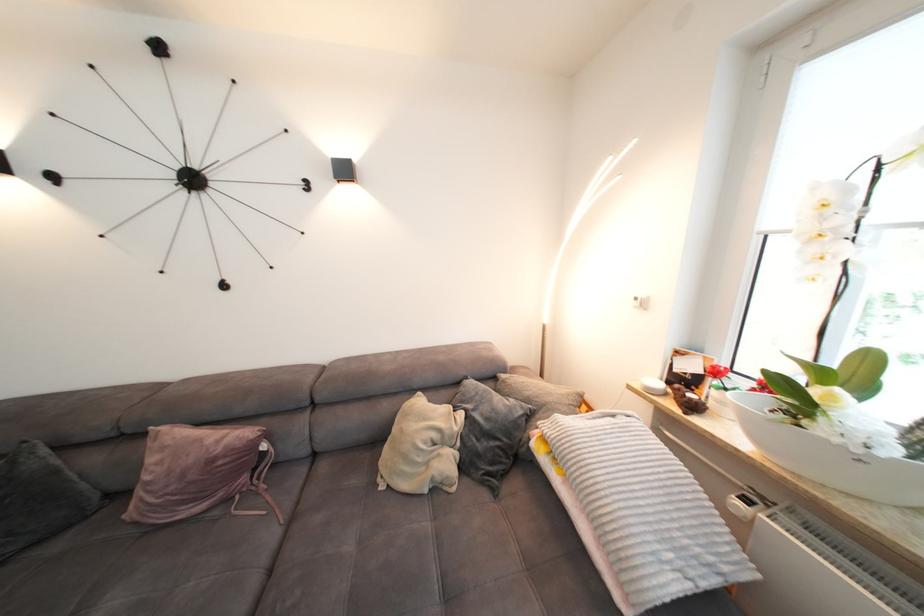
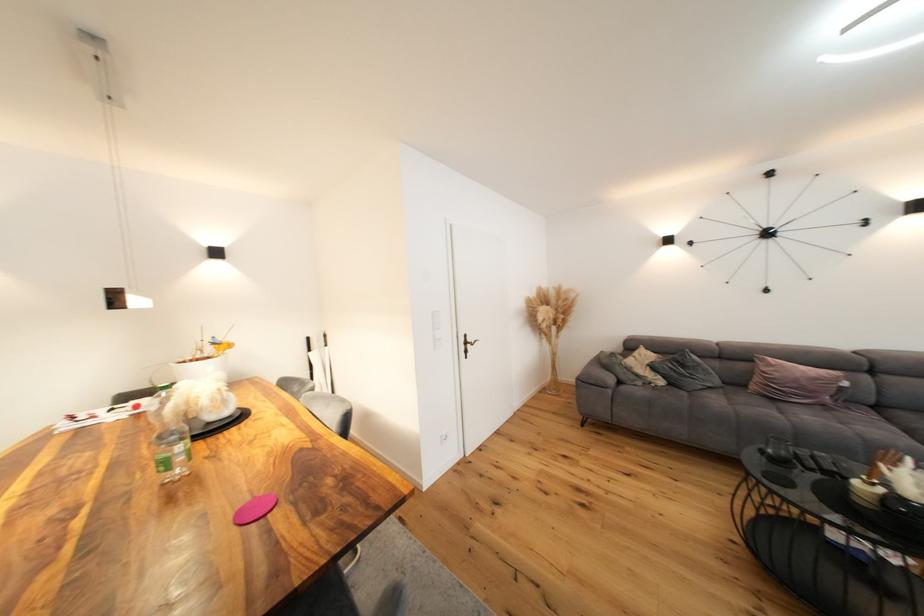
Where in the second image is the point corresponding to pixel 68 544 from the first image?

(727, 392)